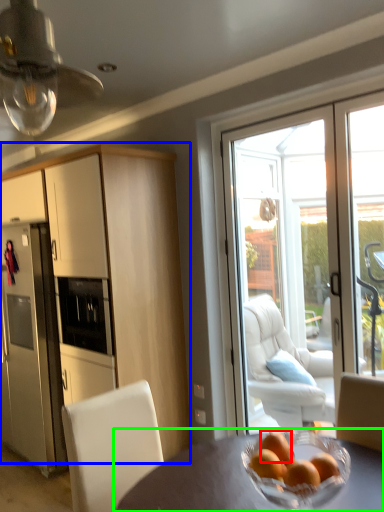
Question: Based on their relative distances, which object is nearer to orange (highlighted by a red box)? Choose from cabinetry (highlighted by a blue box) and table (highlighted by a green box).

Choices:
 (A) cabinetry
 (B) table

Answer: (B)